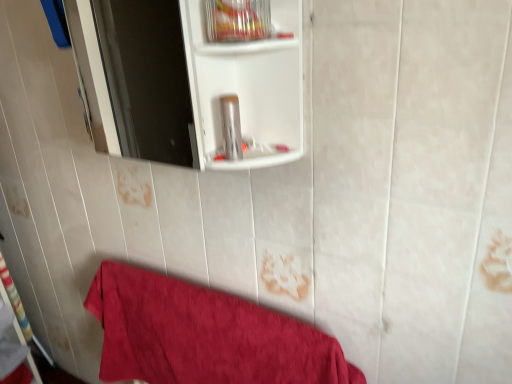
Question: From a real-world perspective, is red cotton towel at lower left beneath silver metallic canister at center?

Choices:
 (A) no
 (B) yes

Answer: (B)

Question: Does red cotton towel at lower left contain silver metallic canister at center?

Choices:
 (A) yes
 (B) no

Answer: (B)

Question: From the image's perspective, does red cotton towel at lower left appear lower than silver metallic canister at center?

Choices:
 (A) yes
 (B) no

Answer: (A)

Question: Is there a large distance between red cotton towel at lower left and silver metallic canister at center?

Choices:
 (A) no
 (B) yes

Answer: (A)

Question: Are red cotton towel at lower left and silver metallic canister at center beside each other?

Choices:
 (A) yes
 (B) no

Answer: (B)

Question: Considering the positions of point (135, 324) and point (234, 145), is point (135, 324) closer or farther from the camera than point (234, 145)?

Choices:
 (A) farther
 (B) closer

Answer: (A)

Question: In terms of height, does red cotton towel at lower left look taller or shorter compared to silver metallic canister at center?

Choices:
 (A) tall
 (B) short

Answer: (A)

Question: In terms of width, does red cotton towel at lower left look wider or thinner when compared to silver metallic canister at center?

Choices:
 (A) wide
 (B) thin

Answer: (A)

Question: From a real-world perspective, is red cotton towel at lower left positioned above or below silver metallic canister at center?

Choices:
 (A) above
 (B) below

Answer: (B)

Question: In the image, is red cotton towel at lower left positioned in front of or behind clear plastic container at upper center?

Choices:
 (A) behind
 (B) front

Answer: (A)

Question: From a real-world perspective, is red cotton towel at lower left positioned above or below clear plastic container at upper center?

Choices:
 (A) above
 (B) below

Answer: (B)

Question: Is point (131, 291) closer or farther from the camera than point (219, 44)?

Choices:
 (A) closer
 (B) farther

Answer: (B)

Question: Considering the relative positions of red cotton towel at lower left and clear plastic container at upper center in the image provided, is red cotton towel at lower left to the left or to the right of clear plastic container at upper center?

Choices:
 (A) left
 (B) right

Answer: (A)

Question: Considering the positions of clear plastic container at upper center and red cotton towel at lower left in the image, is clear plastic container at upper center bigger or smaller than red cotton towel at lower left?

Choices:
 (A) small
 (B) big

Answer: (A)

Question: Is clear plastic container at upper center in front of or behind red cotton towel at lower left in the image?

Choices:
 (A) behind
 (B) front

Answer: (B)